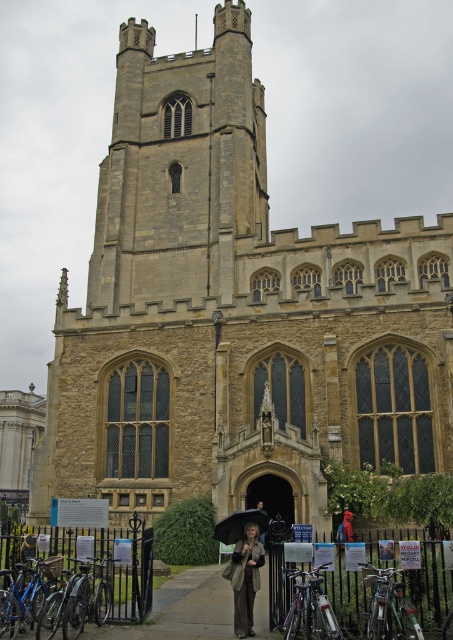
Is green matte bicycle at lower right positioned in front of matte beige coat at center?

Yes, it is in front of matte beige coat at center.

Which of these two, green matte bicycle at lower right or matte beige coat at center, stands taller?

Standing taller between the two is matte beige coat at center.

Does point (380, 580) lie in front of point (245, 528)?

That is True.

At what (x,y) coordinates should I click in order to perform the action: click on green matte bicycle at lower right. Please return your answer as a coordinate pair (x, y). The width and height of the screenshot is (453, 640). Looking at the image, I should click on (389, 605).

Which is above, silver metallic bicycle at lower center or matte beige coat at center?

silver metallic bicycle at lower center is above.

Is point (293, 595) positioned before point (237, 540)?

Yes, it is.

Does point (292, 612) lie in front of point (245, 634)?

That is True.

The width and height of the screenshot is (453, 640). What are the coordinates of `silver metallic bicycle at lower center` in the screenshot? It's located at tap(309, 609).

Does matte beige coat at center appear on the right side of blue metallic bicycle at lower left?

Correct, you'll find matte beige coat at center to the right of blue metallic bicycle at lower left.

Is matte beige coat at center closer to the viewer compared to blue metallic bicycle at lower left?

No.

Find the location of `matte beige coat at center`. matte beige coat at center is located at coordinates (245, 579).